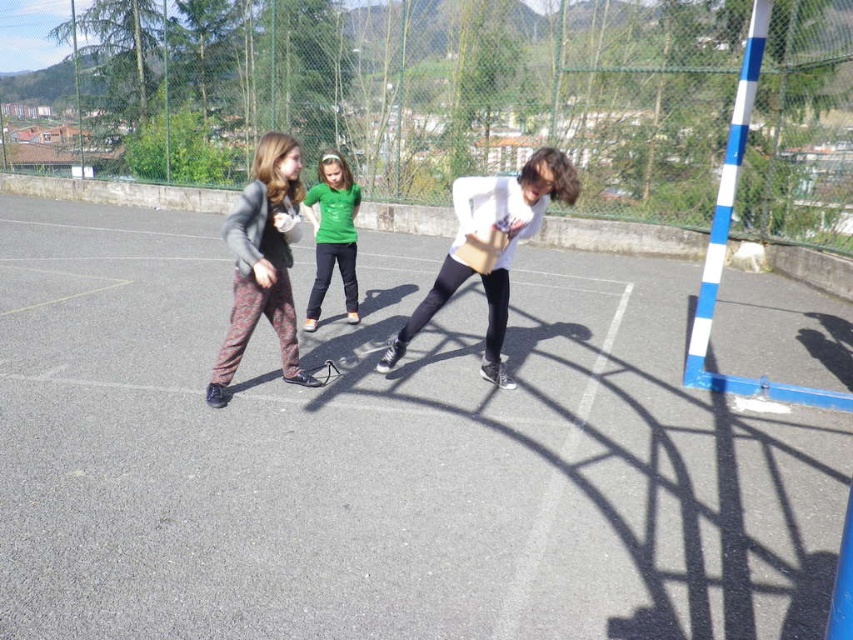
Question: Which object is farther from the camera taking this photo?

Choices:
 (A) patterned fabric pants at center
 (B) white matte shirt at center
 (C) smooth asphalt court at center
 (D) green matte shirt at center

Answer: (D)

Question: Is the position of patterned fabric pants at center more distant than that of green matte shirt at center?

Choices:
 (A) no
 (B) yes

Answer: (A)

Question: Is patterned fabric pants at center above green matte shirt at center?

Choices:
 (A) yes
 (B) no

Answer: (B)

Question: Which object appears farthest from the camera in this image?

Choices:
 (A) patterned fabric pants at center
 (B) white matte shirt at center
 (C) smooth asphalt court at center
 (D) green matte shirt at center

Answer: (D)

Question: Can you confirm if white matte shirt at center is positioned to the left of patterned fabric pants at center?

Choices:
 (A) yes
 (B) no

Answer: (B)

Question: Based on their relative distances, which object is nearer to the white matte shirt at center?

Choices:
 (A) patterned fabric pants at center
 (B) green matte shirt at center
 (C) smooth asphalt court at center

Answer: (A)